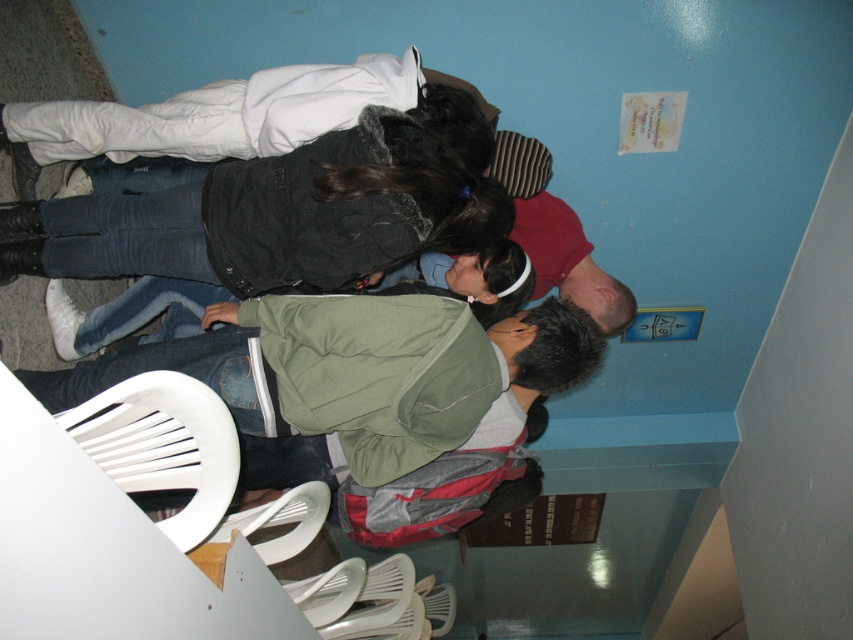
Is point (164, 236) less distant than point (180, 406)?

No, (164, 236) is further to viewer.

Does point (271, 193) come closer to viewer compared to point (192, 378)?

That is False.

This screenshot has width=853, height=640. Identify the location of denim jacket at center. coord(285,211).